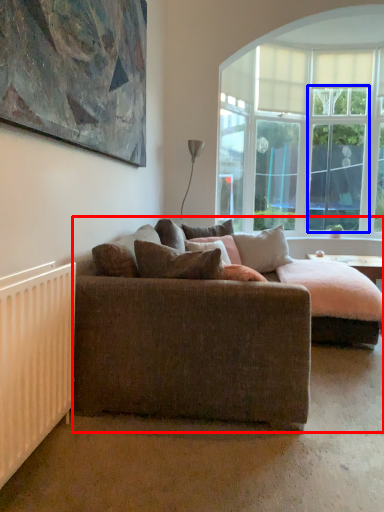
Question: Among these objects, which one is nearest to the camera, studio couch (highlighted by a red box) or glass door (highlighted by a blue box)?

Choices:
 (A) studio couch
 (B) glass door

Answer: (A)